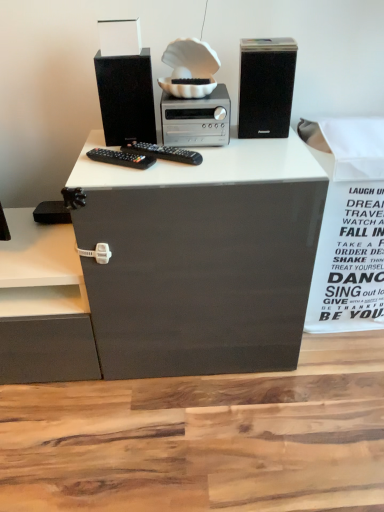
Question: Considering the relative sizes of black matte speaker at upper right, the 2th computer tower when ordered from left to right, and matte black speaker at upper left, the second computer tower from the right, in the image provided, is black matte speaker at upper right, the 2th computer tower when ordered from left to right, taller than matte black speaker at upper left, the second computer tower from the right,?

Choices:
 (A) no
 (B) yes

Answer: (B)

Question: From a real-world perspective, is black matte speaker at upper right, the 2th computer tower when ordered from left to right, located higher than matte black speaker at upper left, the second computer tower from the right?

Choices:
 (A) yes
 (B) no

Answer: (A)

Question: Is black matte speaker at upper right, which is the 1th computer tower in right-to-left order, to the left of matte black speaker at upper left, the second computer tower from the right, from the viewer's perspective?

Choices:
 (A) yes
 (B) no

Answer: (B)

Question: Does black matte speaker at upper right, which is the 1th computer tower in right-to-left order, have a lesser width compared to matte black speaker at upper left, the second computer tower from the right?

Choices:
 (A) no
 (B) yes

Answer: (A)

Question: Can you confirm if black matte speaker at upper right, the 2th computer tower when ordered from left to right, is shorter than matte black speaker at upper left, the second computer tower from the right?

Choices:
 (A) no
 (B) yes

Answer: (A)

Question: In terms of size, does black matte speaker at upper right, the 2th computer tower when ordered from left to right, appear bigger or smaller than matte black speaker at upper left, the second computer tower from the right?

Choices:
 (A) small
 (B) big

Answer: (B)

Question: Is black matte speaker at upper right, the 2th computer tower when ordered from left to right, to the left or to the right of matte black speaker at upper left, which ranks as the 1th computer tower in left-to-right order, in the image?

Choices:
 (A) left
 (B) right

Answer: (B)

Question: Does point (253, 96) appear closer or farther from the camera than point (105, 100)?

Choices:
 (A) farther
 (B) closer

Answer: (A)

Question: From a real-world perspective, relative to matte black speaker at upper left, which ranks as the 1th computer tower in left-to-right order, is black matte speaker at upper right, the 2th computer tower when ordered from left to right, vertically above or below?

Choices:
 (A) below
 (B) above

Answer: (B)

Question: In the image, is white paper at right on the left side or the right side of black matte speaker at upper right, the 2th computer tower when ordered from left to right?

Choices:
 (A) right
 (B) left

Answer: (A)

Question: Is white paper at right taller or shorter than black matte speaker at upper right, which is the 1th computer tower in right-to-left order?

Choices:
 (A) tall
 (B) short

Answer: (A)

Question: Considering their positions, is white paper at right located in front of or behind black matte speaker at upper right, the 2th computer tower when ordered from left to right?

Choices:
 (A) front
 (B) behind

Answer: (B)

Question: From the image's perspective, is white paper at right above or below black matte speaker at upper right, which is the 1th computer tower in right-to-left order?

Choices:
 (A) below
 (B) above

Answer: (A)

Question: From the image's perspective, is silver metallic stereo at center located above or below matte black speaker at upper left, the second computer tower from the right?

Choices:
 (A) below
 (B) above

Answer: (A)

Question: In terms of size, does silver metallic stereo at center appear bigger or smaller than matte black speaker at upper left, the second computer tower from the right?

Choices:
 (A) small
 (B) big

Answer: (B)